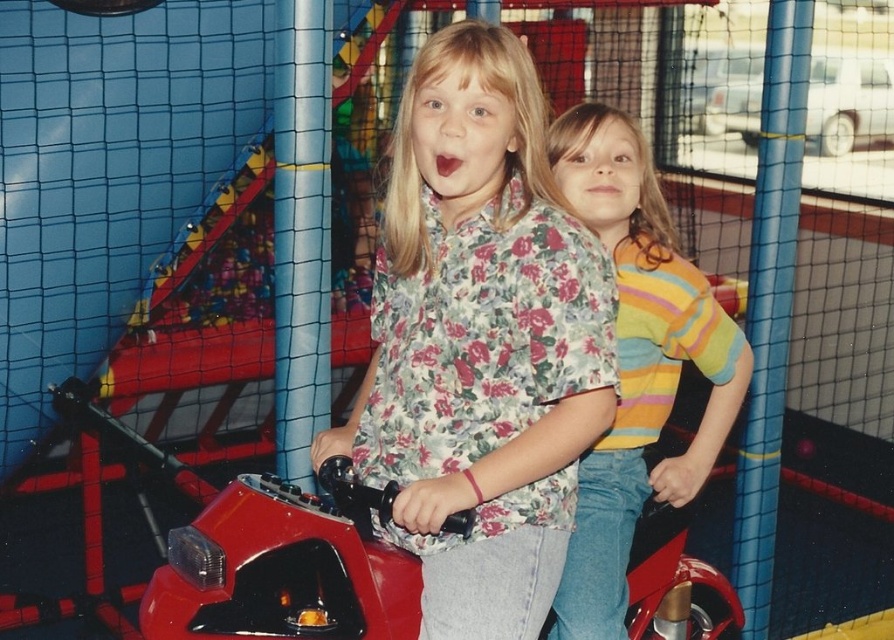
Question: Is floral print shirt at center to the left of shiny red motorcycle at center from the viewer's perspective?

Choices:
 (A) yes
 (B) no

Answer: (B)

Question: Can you confirm if striped cotton shirt at center is positioned to the left of shiny red motorcycle at center?

Choices:
 (A) yes
 (B) no

Answer: (B)

Question: Among these objects, which one is nearest to the camera?

Choices:
 (A) shiny red motorcycle at center
 (B) striped cotton shirt at center

Answer: (A)

Question: Which of these objects is positioned farthest from the striped cotton shirt at center?

Choices:
 (A) floral print shirt at center
 (B) shiny red motorcycle at center

Answer: (B)

Question: Which object is positioned farthest from the striped cotton shirt at center?

Choices:
 (A) floral print shirt at center
 (B) shiny red motorcycle at center

Answer: (B)

Question: Does floral print shirt at center appear over shiny red motorcycle at center?

Choices:
 (A) no
 (B) yes

Answer: (B)